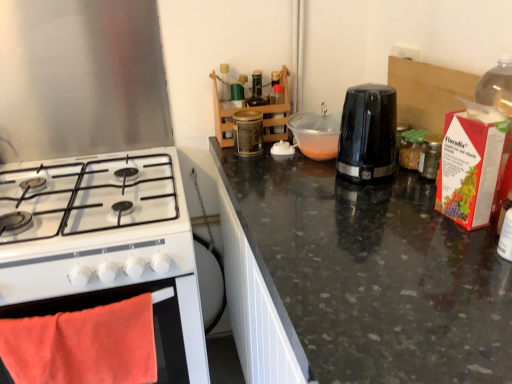
Question: Is orange fabric oven at lower left in front of or behind black plastic toaster at center, the first kitchen appliance from the right, in the image?

Choices:
 (A) front
 (B) behind

Answer: (A)

Question: In terms of size, does orange fabric oven at lower left appear bigger or smaller than black plastic toaster at center, the first kitchen appliance from the right?

Choices:
 (A) big
 (B) small

Answer: (B)

Question: Estimate the real-world distances between objects in this image. Which object is farther from the white glossy gas stove at left, which appears as the 1th kitchen appliance when viewed from the left?

Choices:
 (A) metallic gold canister at center
 (B) black plastic toaster at center, the first kitchen appliance from the right
 (C) orange fabric oven at lower left

Answer: (B)

Question: Which object is the farthest from the white glossy gas stove at left, which is the second kitchen appliance in right-to-left order?

Choices:
 (A) black plastic toaster at center, arranged as the second kitchen appliance when viewed from the left
 (B) metallic gold canister at center
 (C) orange fabric oven at lower left

Answer: (A)